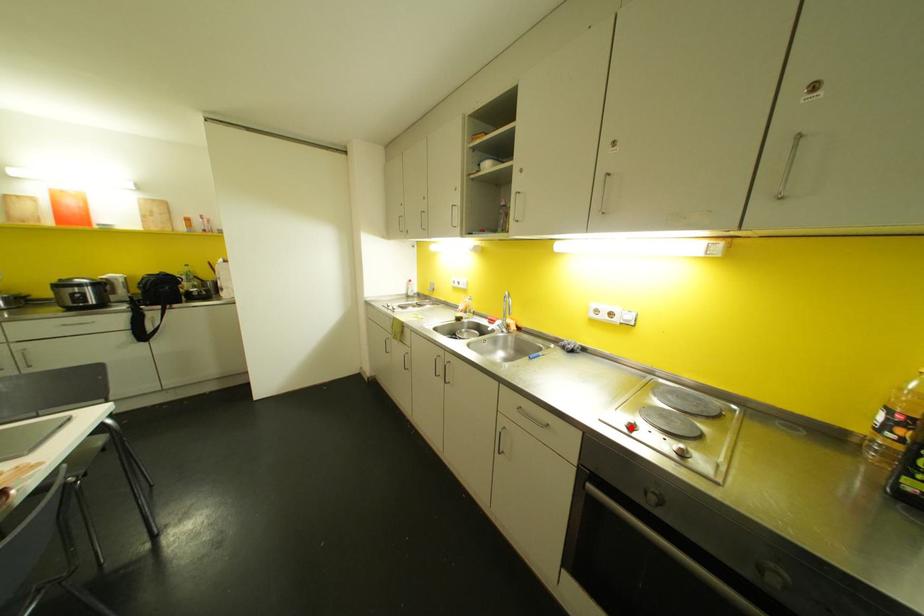
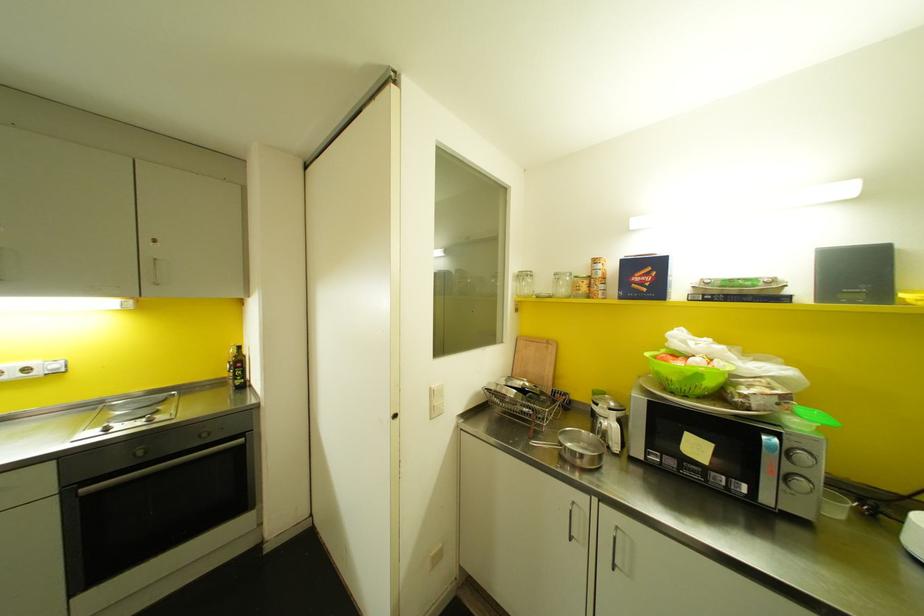
The point at the highlighted location is marked in the first image. Where is the corresponding point in the second image?

(106, 429)